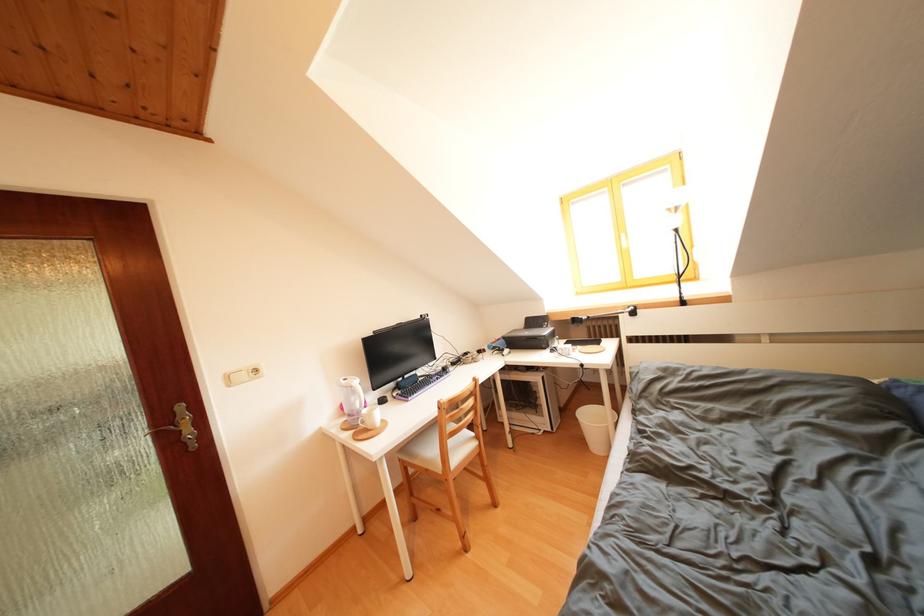
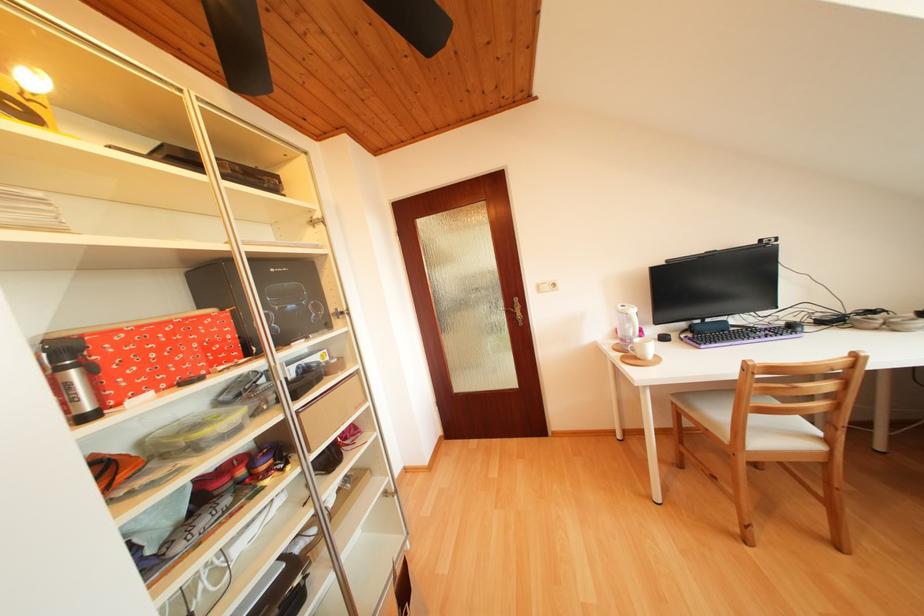
In the second image, find the point that corresponds to (x=504, y=511) in the first image.

(847, 553)